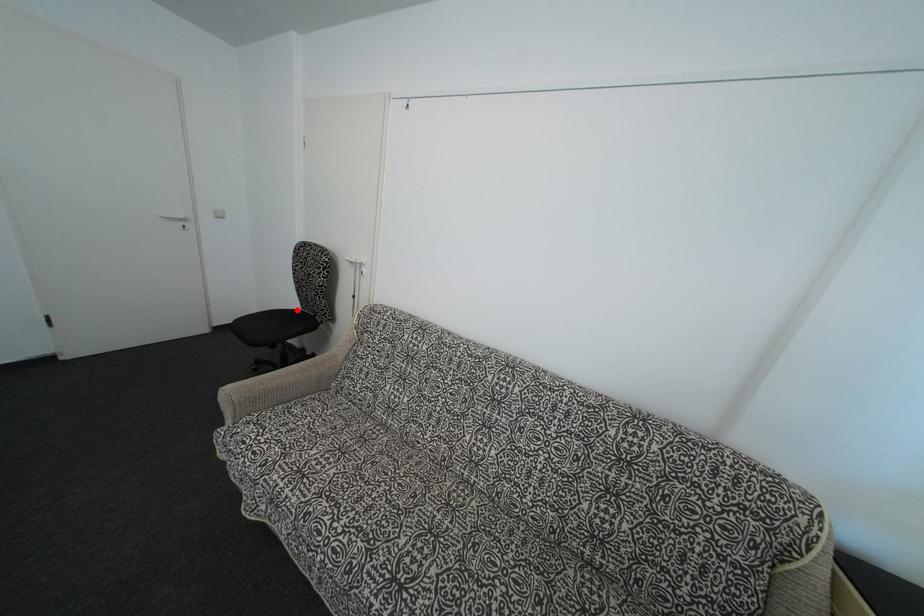
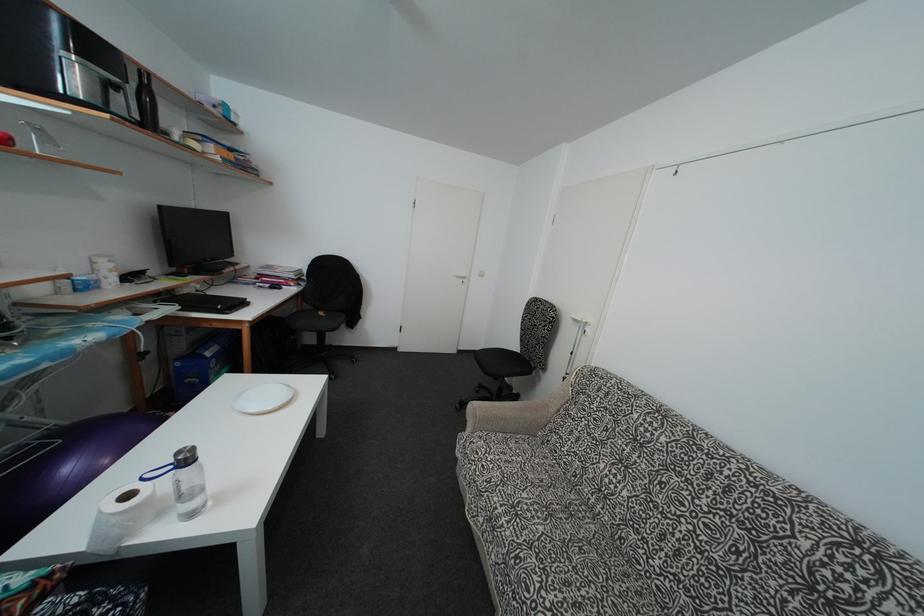
Where in the second image is the point corresponding to the highlighted location from the first image?

(517, 353)